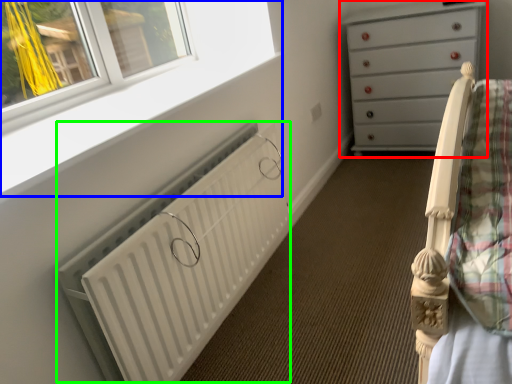
Question: Considering the real-world distances, which object is farthest from chest of drawers (highlighted by a red box)? window frame (highlighted by a blue box) or radiator (highlighted by a green box)?

Choices:
 (A) window frame
 (B) radiator

Answer: (B)